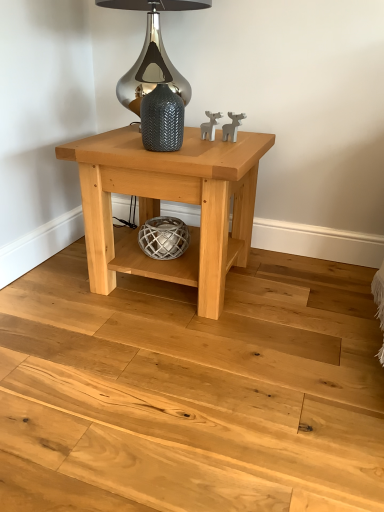
Question: Is natural wood floor at center positioned beyond the bounds of natural wood table at center?

Choices:
 (A) yes
 (B) no

Answer: (A)

Question: Is natural wood floor at center shorter than natural wood table at center?

Choices:
 (A) no
 (B) yes

Answer: (B)

Question: Considering the relative sizes of natural wood floor at center and natural wood table at center in the image provided, is natural wood floor at center wider than natural wood table at center?

Choices:
 (A) no
 (B) yes

Answer: (B)

Question: Could you tell me if natural wood floor at center is facing natural wood table at center?

Choices:
 (A) no
 (B) yes

Answer: (B)

Question: Is natural wood floor at center at the left side of natural wood table at center?

Choices:
 (A) yes
 (B) no

Answer: (A)

Question: In terms of height, does textured gray vase at center look taller or shorter compared to natural wood table at center?

Choices:
 (A) short
 (B) tall

Answer: (A)

Question: Based on their positions, is textured gray vase at center located to the left or right of natural wood table at center?

Choices:
 (A) right
 (B) left

Answer: (B)

Question: From a real-world perspective, relative to natural wood table at center, is textured gray vase at center vertically above or below?

Choices:
 (A) above
 (B) below

Answer: (A)

Question: Is point (167, 117) closer or farther from the camera than point (248, 221)?

Choices:
 (A) farther
 (B) closer

Answer: (B)

Question: Visually, is satin silver glass at upper center positioned to the left or to the right of natural wood floor at center?

Choices:
 (A) left
 (B) right

Answer: (A)

Question: In terms of width, does satin silver glass at upper center look wider or thinner when compared to natural wood floor at center?

Choices:
 (A) thin
 (B) wide

Answer: (A)

Question: From the image's perspective, relative to natural wood floor at center, is satin silver glass at upper center above or below?

Choices:
 (A) below
 (B) above

Answer: (B)

Question: Is satin silver glass at upper center spatially inside natural wood floor at center, or outside of it?

Choices:
 (A) outside
 (B) inside

Answer: (A)

Question: In terms of size, does natural wood floor at center appear bigger or smaller than textured gray vase at center?

Choices:
 (A) small
 (B) big

Answer: (B)

Question: Is natural wood floor at center wider or thinner than textured gray vase at center?

Choices:
 (A) thin
 (B) wide

Answer: (B)